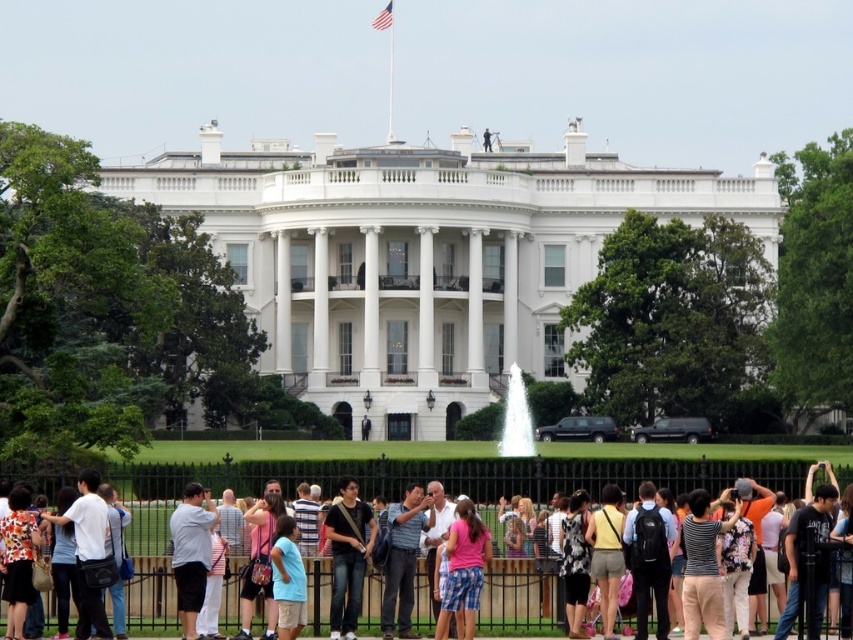
You are a photographer standing at the scene of the White House. You notice a person wearing a light blue shirt at center and white glossy water at center. Which object is closer to you?

The light blue shirt at center is closer to you because it is in front of the white glossy water at center.

You are a photographer planning to take a group photo of the light blue shirt at center and the pink cotton shirt at center. Which person should you ask to move closer to the camera to ensure both fit in the frame?

The light blue shirt at center has a larger width than the pink cotton shirt at center, so you should ask the person wearing the light blue shirt at center to move closer to the camera to ensure both fit in the frame.